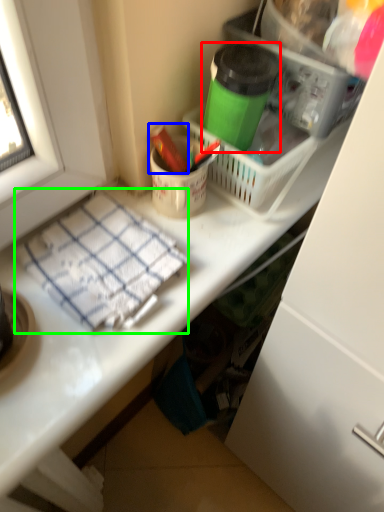
Question: Which is nearer to the bottle (highlighted by a red box)? crayon (highlighted by a blue box) or blanket (highlighted by a green box).

Choices:
 (A) crayon
 (B) blanket

Answer: (A)